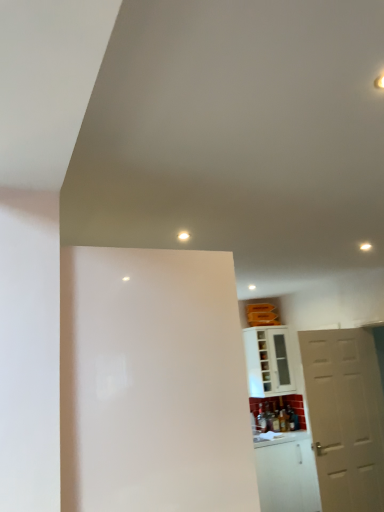
Question: Do you think white glossy screen door at center is within white matte door at right, or outside of it?

Choices:
 (A) outside
 (B) inside

Answer: (A)

Question: From a real-world perspective, is white glossy screen door at center positioned above or below white matte door at right?

Choices:
 (A) below
 (B) above

Answer: (B)

Question: Which object is positioned farthest from the white glossy cabinet at lower right?

Choices:
 (A) white matte door at right
 (B) white glossy screen door at center

Answer: (B)

Question: Based on their relative distances, which object is farther from the white glossy cabinet at lower right?

Choices:
 (A) white matte door at right
 (B) white glossy screen door at center

Answer: (B)